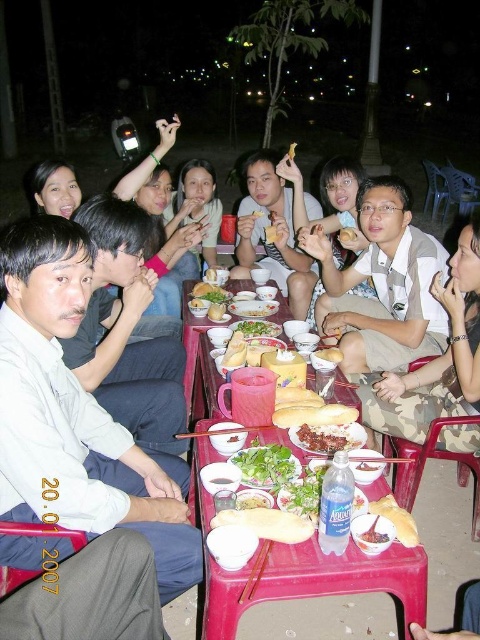
You are a photographer standing in front of the scene. You want to take a photo of the white matte shirt at left and the matte yellow bread at center. Which object will appear larger in your photo?

The white matte shirt at left appears larger in the photo because it is closer to the viewer than the matte yellow bread at center.

You are a guest at this dinner and want to reach for the shiny brown meat at center and the smooth yellow bread at center. Which one is wider?

The shiny brown meat at center is wider than the smooth yellow bread at center.